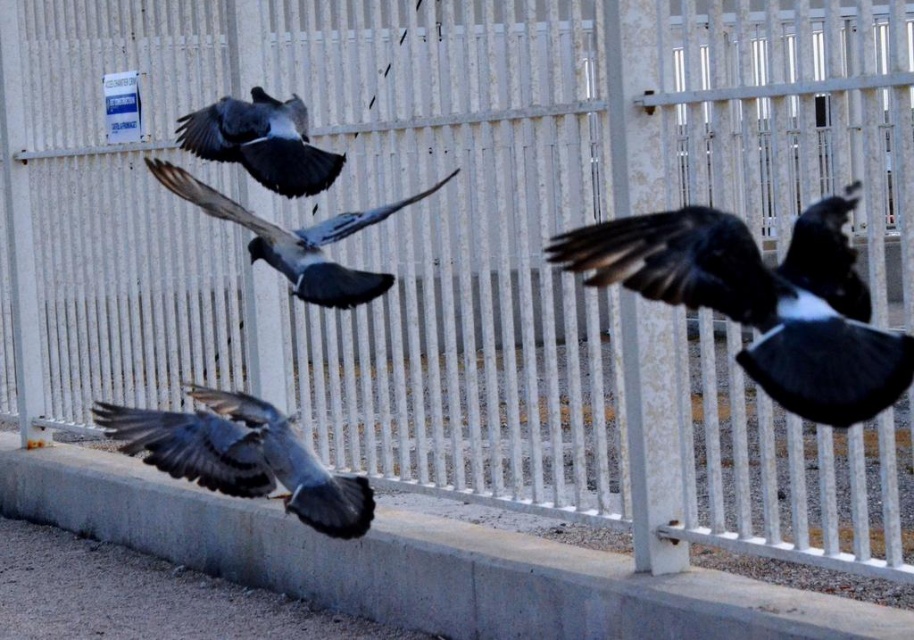
Question: Is black glossy bird at right wider than gray matte pigeon at upper center?

Choices:
 (A) no
 (B) yes

Answer: (B)

Question: Does gray matte pigeon at center have a greater width compared to gray matte pigeon at upper center?

Choices:
 (A) yes
 (B) no

Answer: (A)

Question: Which point is closer to the camera?

Choices:
 (A) gray matte pigeon at lower left
 (B) gray matte pigeon at center
 (C) black glossy bird at right

Answer: (C)

Question: Is gray matte pigeon at lower left thinner than gray matte pigeon at upper center?

Choices:
 (A) no
 (B) yes

Answer: (A)

Question: Among these points, which one is farthest from the camera?

Choices:
 (A) (177, 170)
 (B) (319, 177)

Answer: (B)

Question: Among these points, which one is nearest to the camera?

Choices:
 (A) (220, 484)
 (B) (817, 241)
 (C) (256, 131)
 (D) (314, 250)

Answer: (B)